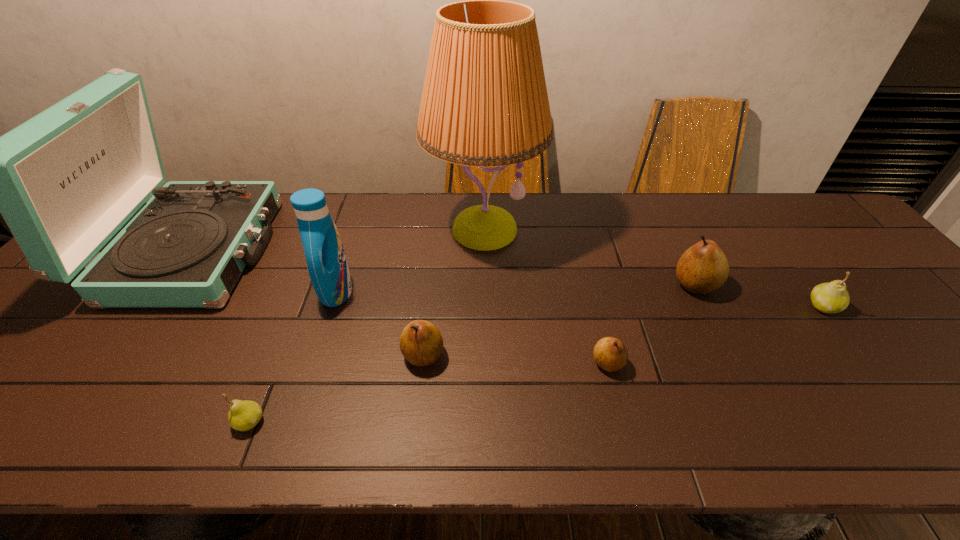
The height and width of the screenshot is (540, 960). Identify the location of the leftmost brown pear. pos(421,343).

Locate an element on the screen. The height and width of the screenshot is (540, 960). the fourth pear from right to left is located at coordinates (421, 343).

Find the location of a particular element. the second brown pear from left to right is located at coordinates (610, 353).

This screenshot has height=540, width=960. What are the coordinates of `the smallest brown pear` in the screenshot? It's located at (610, 353).

Find the location of `the leftmost pear`. the leftmost pear is located at coordinates (244, 415).

Identify the location of the nearer green pear. This screenshot has height=540, width=960. (244, 415).

In order to click on blank space located on the side of the lamp near the pull switch in this screenshot , I will do `click(485, 345)`.

At what (x,y) coordinates should I click in order to perform the action: click on vacant space located 0.270m on the face side of the seventh shortest object. Please return your answer as a coordinate pair (x, y). The image size is (960, 540). Looking at the image, I should click on (363, 251).

What are the coordinates of `vacant space situated on the front-facing side of the sixth object from right to left` in the screenshot? It's located at (468, 291).

What are the coordinates of `vacant space located 0.160m on the left of the second object from right to left` in the screenshot? It's located at (612, 285).